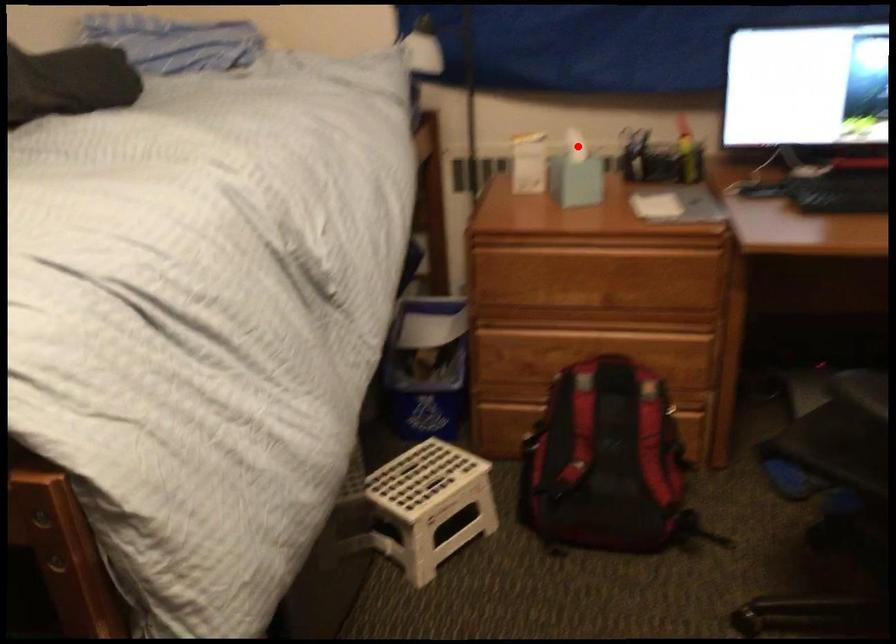
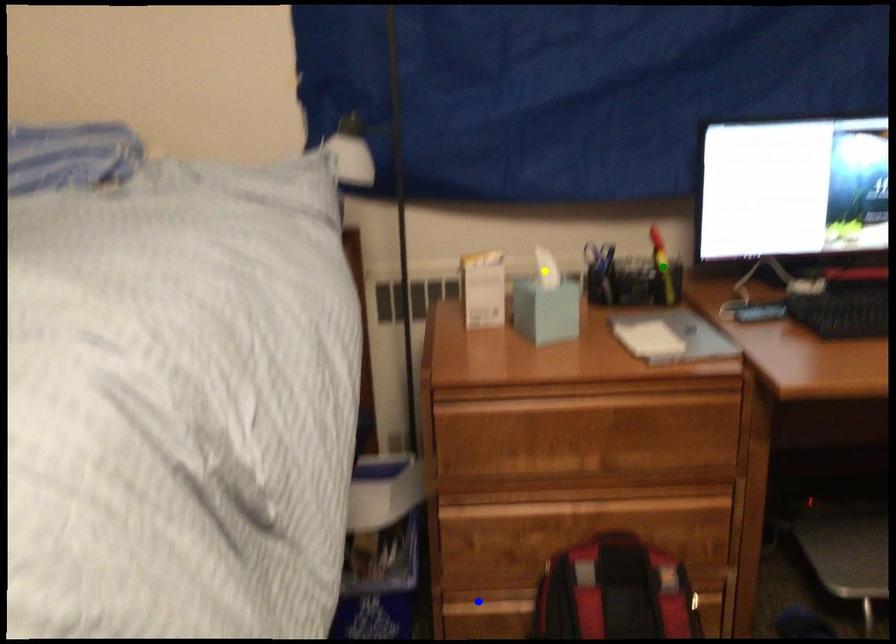
Question: I am providing you with two images of the same scene from different viewpoints. A red point is marked on the first image. You are given multiple points on the second image. Which spot in image 2 lines up with the point in image 1?

Choices:
 (A) green point
 (B) yellow point
 (C) blue point

Answer: (B)